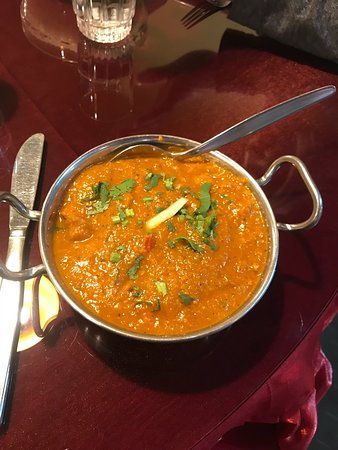
You are a GUI agent. You are given a task and a screenshot of the screen. Output one action in this format:
    pyautogui.click(x=<x>, y=<y>)
    Task: Click on the utensils
    
    Given the screenshot: What is the action you would take?
    pyautogui.click(x=28, y=176), pyautogui.click(x=187, y=151)